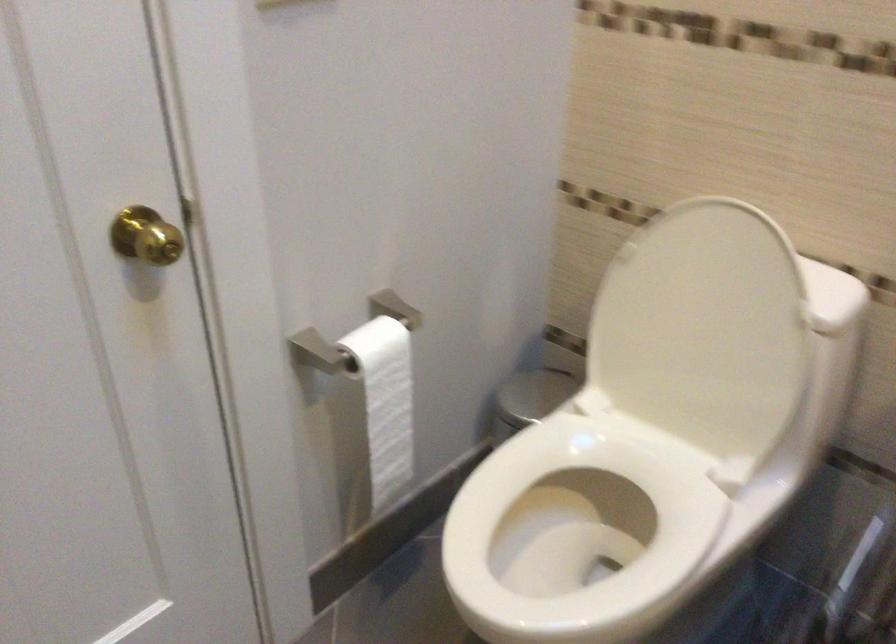
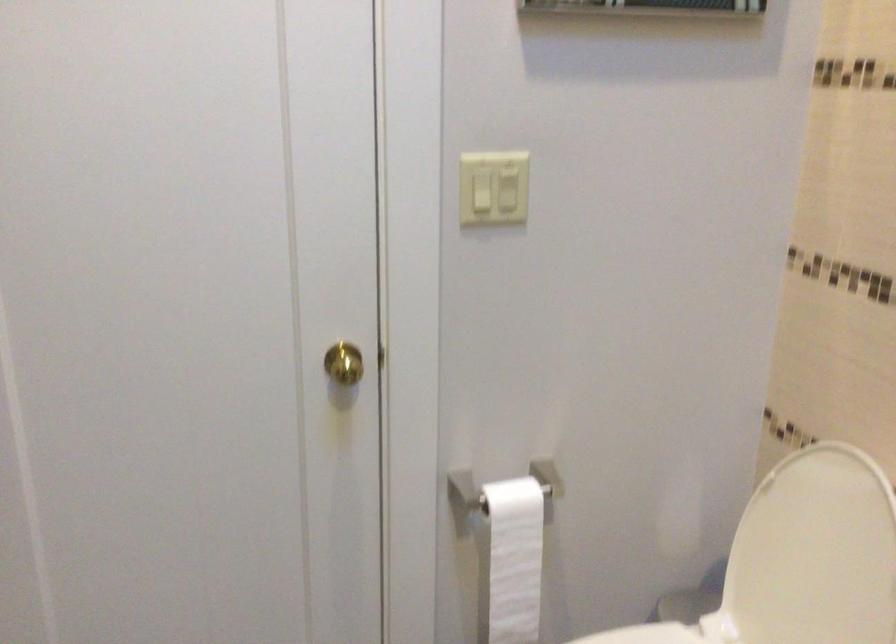
In the second image, find the point that corresponds to pixel 688 312 in the first image.

(813, 554)